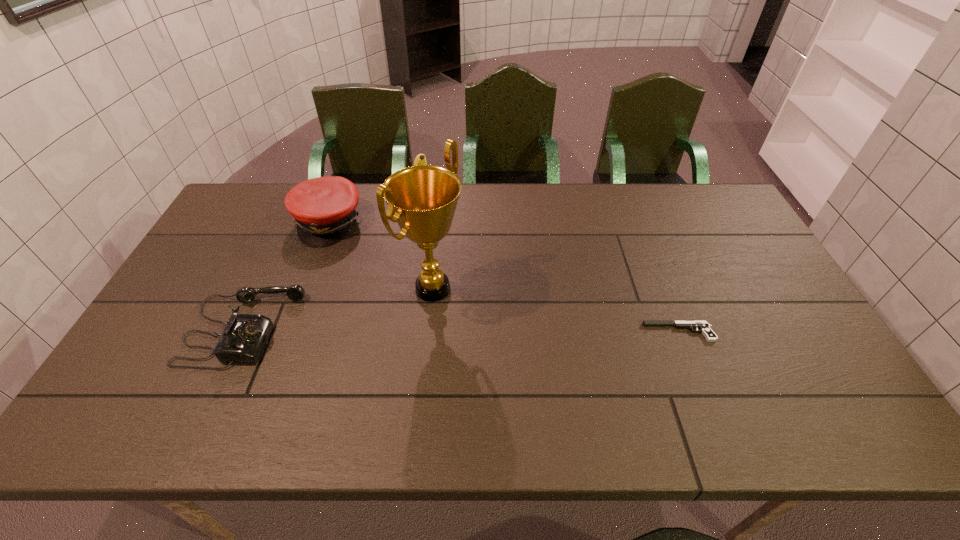
Where is `telephone`? The height and width of the screenshot is (540, 960). telephone is located at coordinates (244, 337).

I want to click on pistol, so tap(704, 327).

Where is `the rightmost object`? The height and width of the screenshot is (540, 960). the rightmost object is located at coordinates (704, 327).

Image resolution: width=960 pixels, height=540 pixels. Find the location of `the tallest object`. the tallest object is located at coordinates (422, 199).

At what (x,y) coordinates should I click in order to perform the action: click on the fourth shortest object. Please return your answer as a coordinate pair (x, y). This screenshot has width=960, height=540. Looking at the image, I should click on (420, 159).

I want to click on cap, so click(x=324, y=209).

In order to click on vacant space located 0.290m on the dial of the telephone in this screenshot , I will do `click(407, 328)`.

Identify the location of vacant point located 0.220m on the front-facing side of the rightmost object. (561, 332).

You are a GUI agent. You are given a task and a screenshot of the screen. Output one action in this format:
    pyautogui.click(x=<x>, y=<y>)
    Task: Click on the vacant space located 0.360m on the front-facing side of the rightmost object
    
    Given the screenshot: What is the action you would take?
    pyautogui.click(x=507, y=332)

What are the coordinates of `free space located 0.110m on the front-facing side of the rightmost object` in the screenshot? It's located at (603, 332).